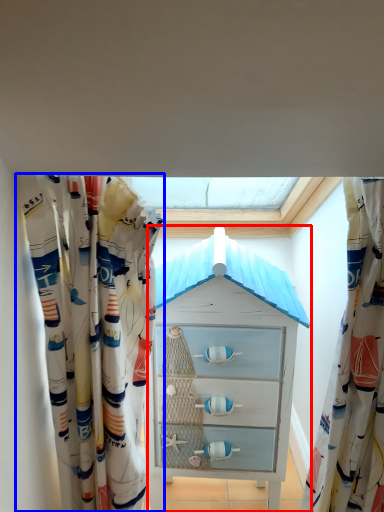
Question: Which point is further to the camera, chest of drawers (highlighted by a red box) or curtain (highlighted by a blue box)?

Choices:
 (A) chest of drawers
 (B) curtain

Answer: (A)